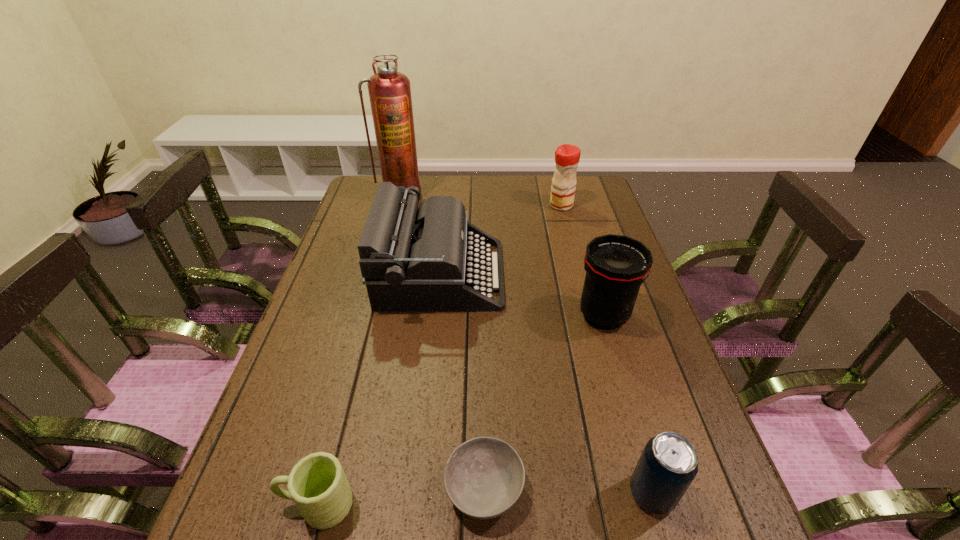
This screenshot has height=540, width=960. Find the location of `free space between the mug and the typewriter`. free space between the mug and the typewriter is located at coordinates (379, 389).

Where is `free spot between the typewriter and the telephoto lens`? Image resolution: width=960 pixels, height=540 pixels. free spot between the typewriter and the telephoto lens is located at coordinates [x=522, y=295].

You are a GUI agent. You are given a task and a screenshot of the screen. Output one action in this format:
    pyautogui.click(x=<x>, y=<y>)
    Task: Click on the object identified as the sixth closest to the bowl
    
    Given the screenshot: What is the action you would take?
    pyautogui.click(x=389, y=91)

Where is `object that is the second nearest to the condiment`? object that is the second nearest to the condiment is located at coordinates (616, 266).

You are a GUI agent. You are given a task and a screenshot of the screen. Output one action in this format:
    pyautogui.click(x=<x>, y=<y>)
    Task: Click on the free space that satisfies the following two spatial constraints: 1. on the typing side of the telephoto lens; 2. on the left side of the typewriter
    
    Given the screenshot: What is the action you would take?
    click(437, 315)

The height and width of the screenshot is (540, 960). Find the location of `free point that satisfies the following two spatial constraints: 1. on the typing side of the typewriter; 2. on the right side of the soda can`. free point that satisfies the following two spatial constraints: 1. on the typing side of the typewriter; 2. on the right side of the soda can is located at coordinates (419, 493).

You are a GUI agent. You are given a task and a screenshot of the screen. Output one action in this format:
    pyautogui.click(x=<x>, y=<y>)
    Task: Click on the free space in the image that satisfies the following two spatial constraints: 1. on the side of the tallest object with the label; 2. on the side of the mug with the handle
    
    Given the screenshot: What is the action you would take?
    pyautogui.click(x=320, y=504)

At what (x,y) coordinates should I click in order to perform the action: click on free spot that satisfies the following two spatial constraints: 1. on the typing side of the soda can; 2. on the left side of the typewriter. Please return your answer as a coordinate pair (x, y). The image size is (960, 540). Looking at the image, I should click on (419, 493).